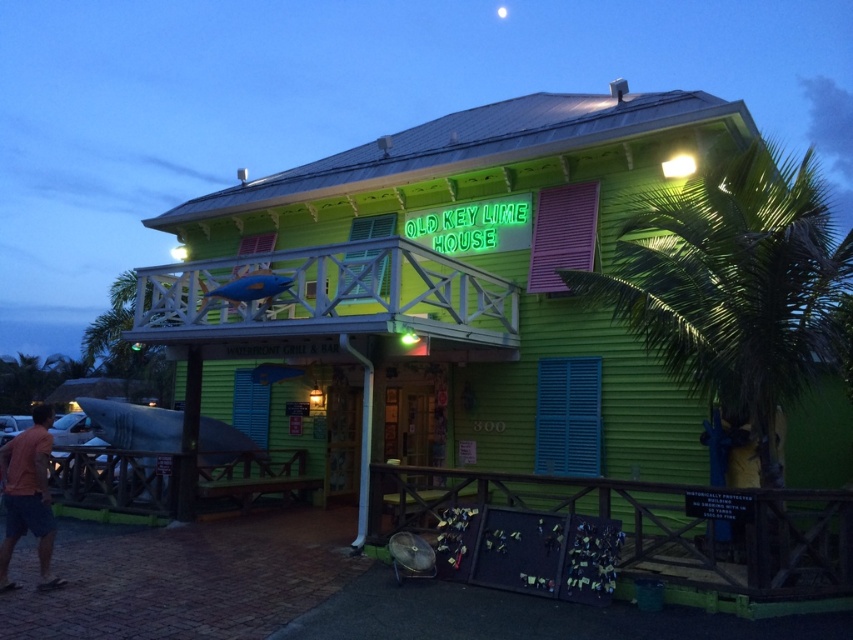
Does point (16, 586) come farther from viewer compared to point (519, 193)?

No, it is not.

Where is `orange cotton t-shirt at lower left`? orange cotton t-shirt at lower left is located at coordinates (28, 497).